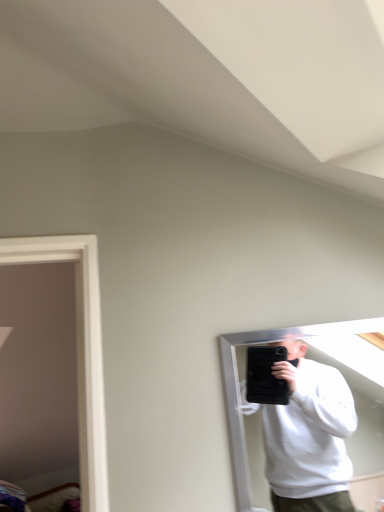
The width and height of the screenshot is (384, 512). What do you see at coordinates (239, 386) in the screenshot?
I see `black matte tablet at right` at bounding box center [239, 386].

Find the location of a particular element. black matte tablet at right is located at coordinates [x=239, y=386].

Identify the location of black matte tablet at right. (239, 386).